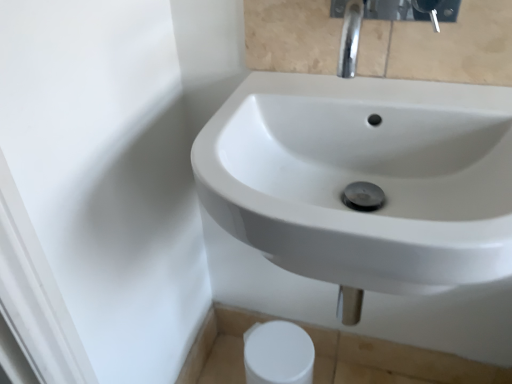
The image size is (512, 384). In order to click on vacant space in chrome metallic faucet at upper center (from a real-world perspective) in this screenshot , I will do `click(380, 92)`.